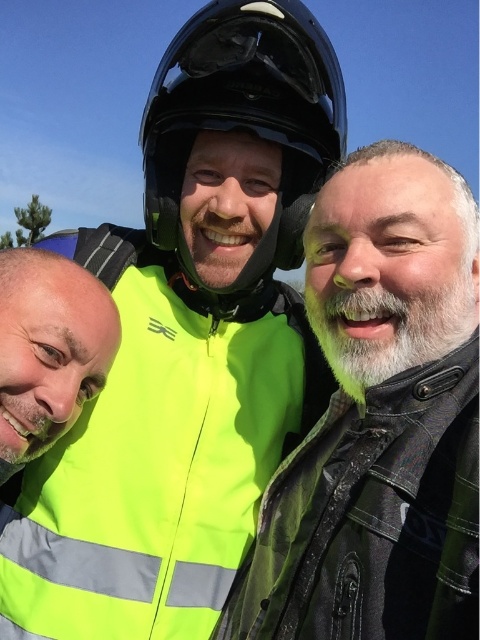
You are a pedestrian walking on a road and see two neon yellow vests. The neon yellow reflective vest at center and the neon yellow vest at left. According to the image, which one is positioned to the right of the other?

The neon yellow reflective vest at center is positioned to the right of the neon yellow vest at left.

You are a pedestrian walking on the sidewalk and see two neon yellow vests in the scene. Which one is closer to you, the neon yellow reflective vest at center or the neon yellow vest at left?

The neon yellow reflective vest at center is closer to you because the neon yellow vest at left is behind it.

You are a photographer trying to capture a group photo of the three people in the scene. You notice the neon yellow jacket at center and the glossy black helmet at center. Which object should you focus on to ensure it fits entirely within the frame if your camera has a limited field of view?

The neon yellow jacket at center has a smaller width than the glossy black helmet at center, so focusing on the neon yellow jacket at center would ensure it fits entirely within the frame.